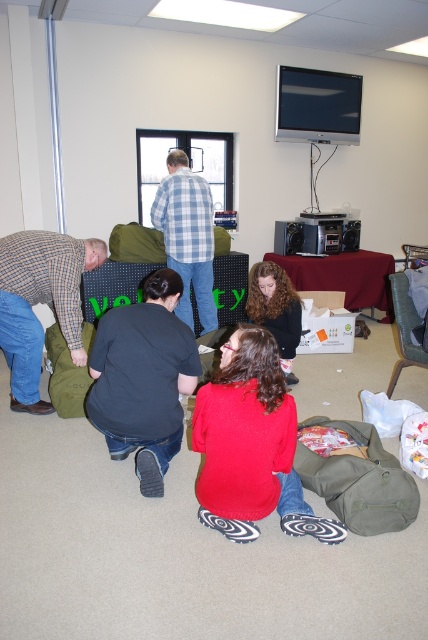
Question: Does black cotton shirt at lower center have a lesser width compared to curly hair at lower center?

Choices:
 (A) no
 (B) yes

Answer: (A)

Question: Which point is closer to the camera taking this photo?

Choices:
 (A) (264, 316)
 (B) (118, 396)

Answer: (B)

Question: Can you confirm if black cotton shirt at lower center is thinner than curly hair at lower center?

Choices:
 (A) yes
 (B) no

Answer: (B)

Question: Which object appears farthest from the camera in this image?

Choices:
 (A) black cotton shirt at lower center
 (B) plaid wool sweater at left
 (C) blue plaid shirt at center

Answer: (C)

Question: Which object appears closest to the camera in this image?

Choices:
 (A) curly hair at lower center
 (B) black cotton shirt at lower center

Answer: (B)

Question: From the image, what is the correct spatial relationship of blue plaid shirt at center in relation to curly hair at lower center?

Choices:
 (A) right
 (B) left

Answer: (B)